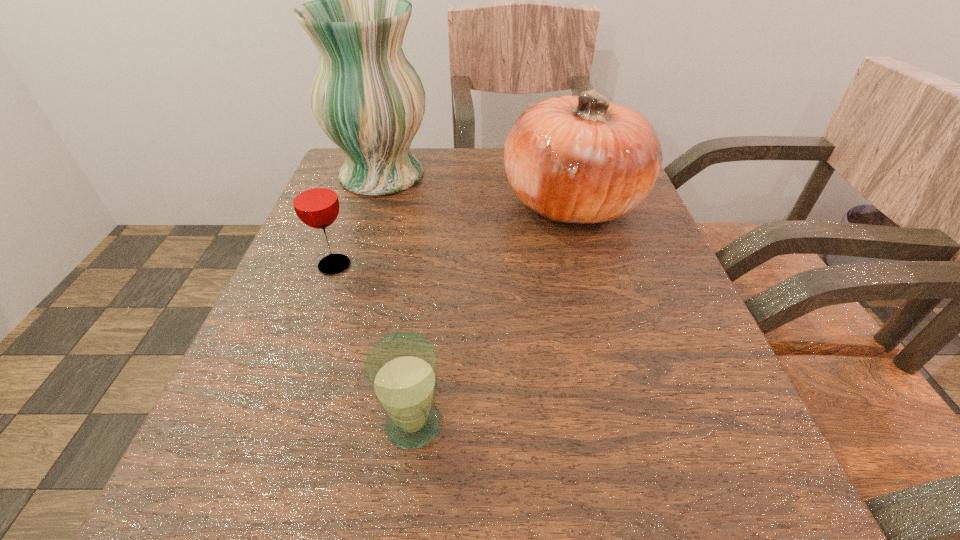
This screenshot has height=540, width=960. Find the location of `blank space located on the back of the nearest object`. blank space located on the back of the nearest object is located at coordinates (425, 326).

Identify the location of vase positioned at the far edge. Image resolution: width=960 pixels, height=540 pixels. (368, 99).

At what (x,y) coordinates should I click in order to perform the action: click on pumpkin that is at the far edge. Please return your answer as a coordinate pair (x, y). The width and height of the screenshot is (960, 540). Looking at the image, I should click on (581, 159).

Where is `object present at the near edge`? object present at the near edge is located at coordinates (401, 368).

Locate an element on the screen. vase that is positioned at the left edge is located at coordinates pyautogui.click(x=368, y=99).

Where is `glass that is at the left edge`? glass that is at the left edge is located at coordinates (314, 197).

Locate an element on the screen. object that is at the right edge is located at coordinates (581, 159).

The width and height of the screenshot is (960, 540). What are the coordinates of `object situated at the far left corner` in the screenshot? It's located at (368, 99).

Where is `object positioned at the far right corner`? object positioned at the far right corner is located at coordinates [x=581, y=159].

In the image, there is a desktop. At what (x,y) coordinates should I click in order to perform the action: click on free space at the far edge. Please return your answer as a coordinate pair (x, y). Image resolution: width=960 pixels, height=540 pixels. Looking at the image, I should click on (491, 180).